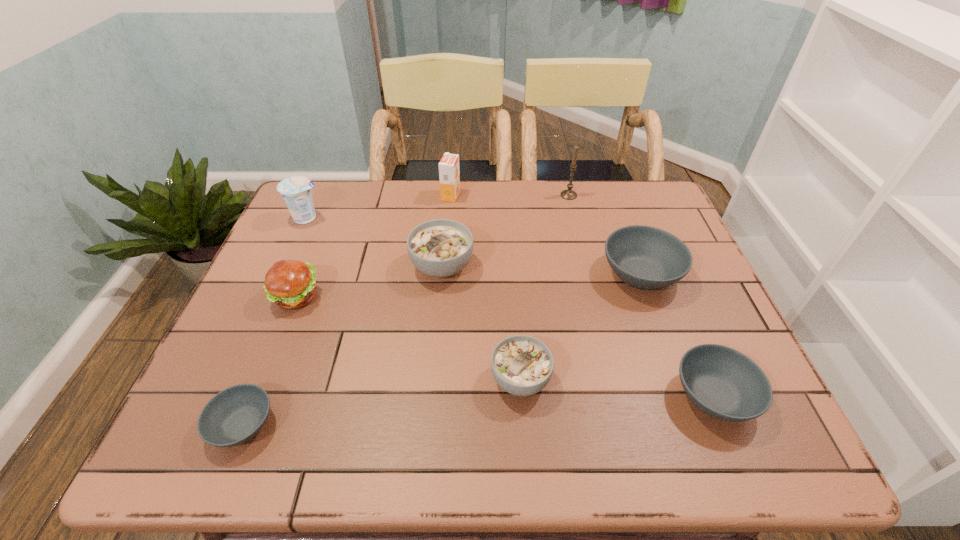
The height and width of the screenshot is (540, 960). Find the location of `blank space located on the front of the hamburger`. blank space located on the front of the hamburger is located at coordinates (238, 441).

Locate an element on the screen. The width and height of the screenshot is (960, 540). vacant space located 0.150m on the left of the farthest gray soup bowl is located at coordinates (542, 274).

The width and height of the screenshot is (960, 540). Identify the location of vacant space located 0.390m on the left of the right white soup bowl. (305, 379).

Locate an element on the screen. The image size is (960, 540). vacant space located on the back of the second biggest gray soup bowl is located at coordinates (657, 259).

Image resolution: width=960 pixels, height=540 pixels. Identify the location of free space located on the right of the leftmost gray soup bowl. (477, 425).

Find the location of a particular element. candle at the far edge is located at coordinates (569, 194).

This screenshot has height=540, width=960. In order to click on orange juice present at the far edge in this screenshot , I will do `click(449, 174)`.

The image size is (960, 540). Find the location of `yogurt that is at the far edge`. yogurt that is at the far edge is located at coordinates (296, 192).

This screenshot has width=960, height=540. Identify the location of yogurt present at the left edge. (296, 192).

Image resolution: width=960 pixels, height=540 pixels. I want to click on hamburger that is positioned at the left edge, so click(291, 284).